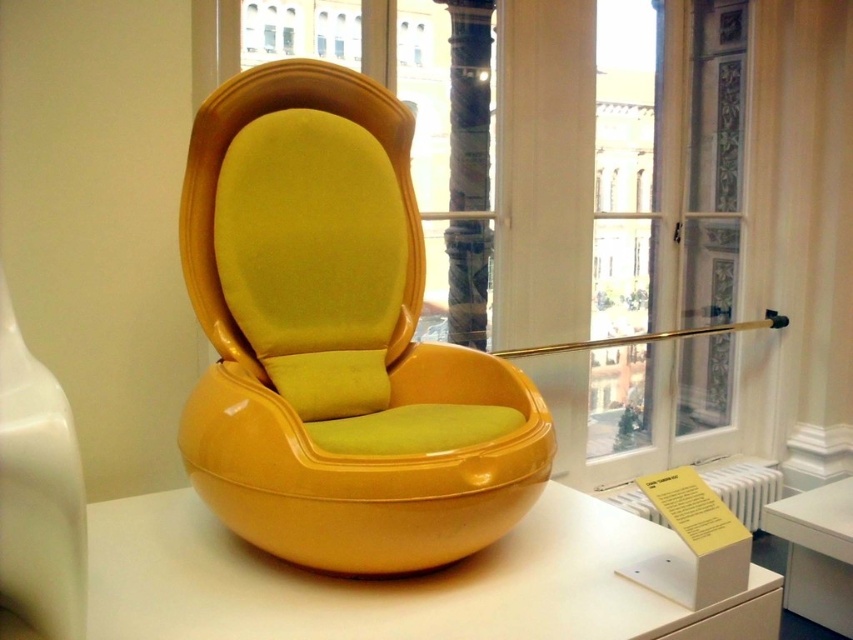
You are a delivery person who needs to place a package on the matte white table at center. The package is 6 feet long. Can you fit the package on the table without it overlapping the glossy yellow chair at center?

The glossy yellow chair at center is 5.46 feet away from the matte white table at center. Since the package is 6 feet long, it would extend beyond the table and overlap the chair, so it won